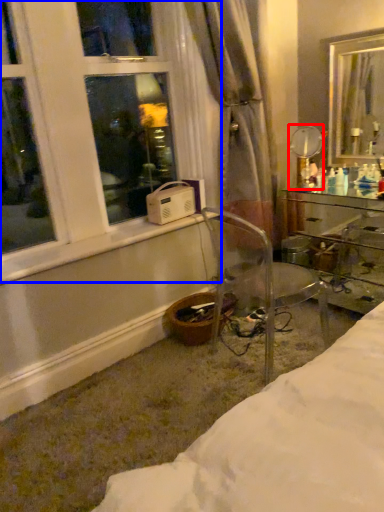
Question: Which object is closer to the camera taking this photo, mirror (highlighted by a red box) or window (highlighted by a blue box)?

Choices:
 (A) mirror
 (B) window

Answer: (B)